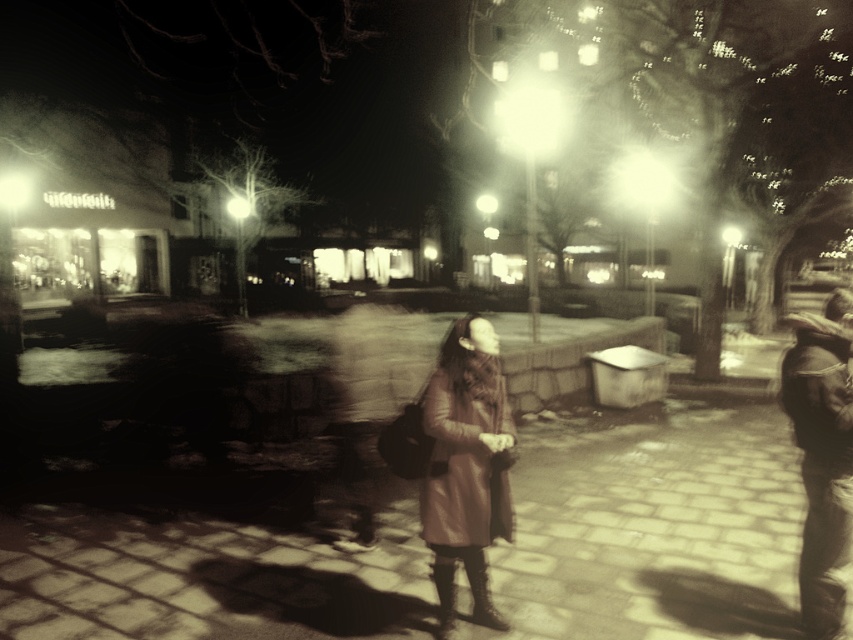
Question: Is smooth stone pavement at center wider than leather jacket at right?

Choices:
 (A) no
 (B) yes

Answer: (B)

Question: Is smooth stone pavement at center thinner than leather jacket at right?

Choices:
 (A) yes
 (B) no

Answer: (B)

Question: Which object is closer to the camera taking this photo?

Choices:
 (A) leather coat at center
 (B) leather jacket at right

Answer: (B)

Question: Which object is positioned farthest from the leather jacket at right?

Choices:
 (A) matte brown coat at center
 (B) smooth stone pavement at center

Answer: (B)

Question: Which of the following is the closest to the observer?

Choices:
 (A) smooth stone pavement at center
 (B) matte brown coat at center
 (C) leather jacket at right
 (D) leather coat at center

Answer: (C)

Question: Observing the image, what is the correct spatial positioning of leather coat at center in reference to matte brown coat at center?

Choices:
 (A) left
 (B) right

Answer: (B)